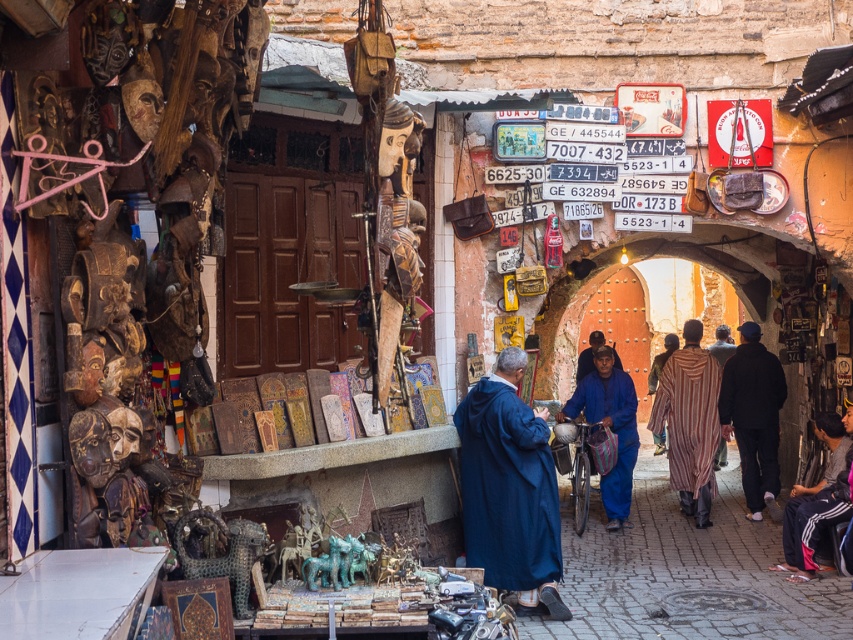
Question: Estimate the real-world distances between objects in this image. Which object is farther from the blue matte robe at center?

Choices:
 (A) blue cotton robe at center
 (B) black matte jacket at right
 (C) striped woolen robe at center
 (D) dark blue woolen robe at lower right

Answer: (A)

Question: Is the position of blue cotton robe at center more distant than that of dark blue woolen robe at lower right?

Choices:
 (A) yes
 (B) no

Answer: (B)

Question: Is blue cotton robe at center smaller than dark blue woolen robe at lower right?

Choices:
 (A) no
 (B) yes

Answer: (A)

Question: Is black matte jacket at right smaller than blue matte robe at center?

Choices:
 (A) no
 (B) yes

Answer: (A)

Question: Which point is closer to the camera?

Choices:
 (A) striped woolen robe at center
 (B) black matte jacket at right
 (C) blue cotton robe at center
 (D) dark blue woolen robe at lower right

Answer: (C)

Question: Which object is farther from the camera taking this photo?

Choices:
 (A) blue matte robe at center
 (B) black matte jacket at right

Answer: (B)